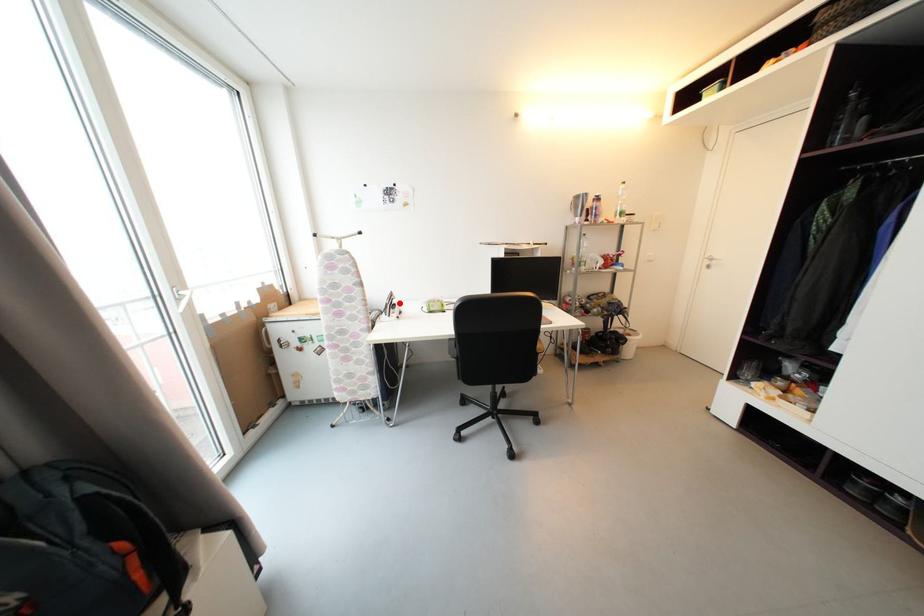
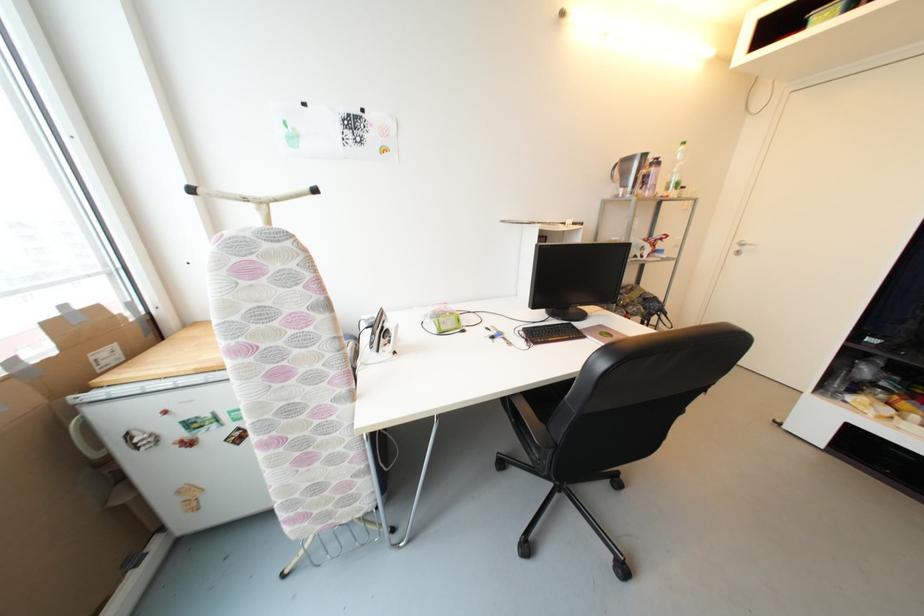
The point at the highlighted location is marked in the first image. Where is the corresponding point in the second image?

(393, 328)